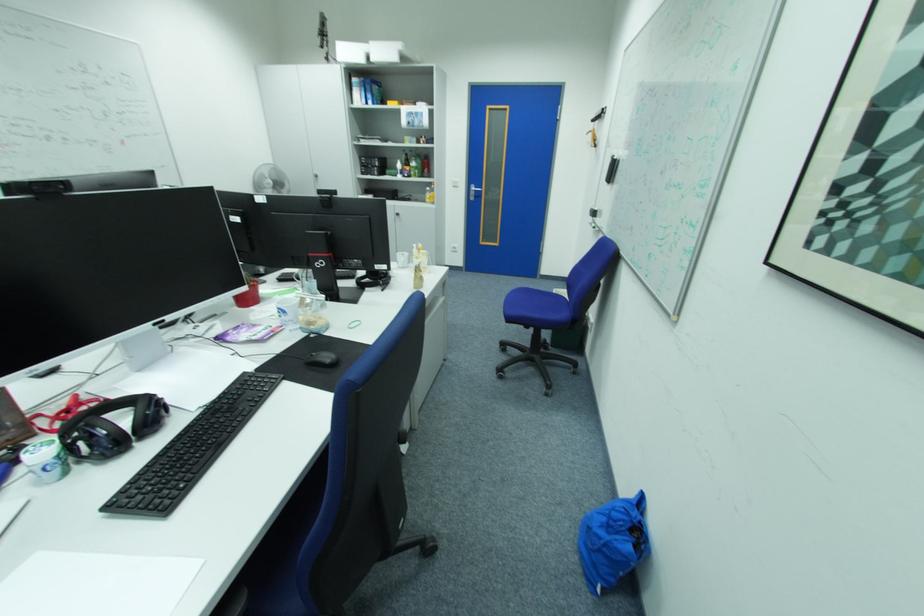
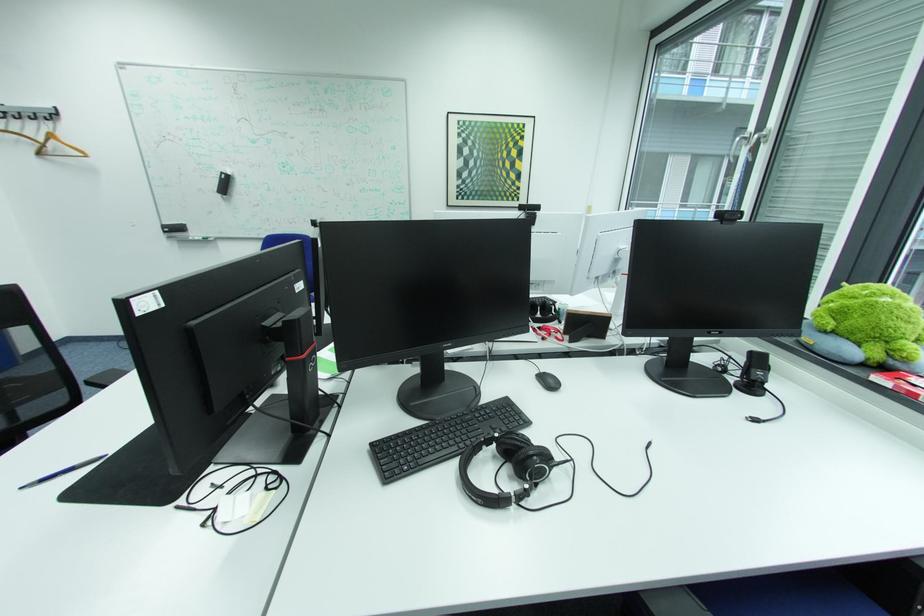
Locate, in the second image, the point that corresponds to point 693,197 in the first image.

(393, 195)